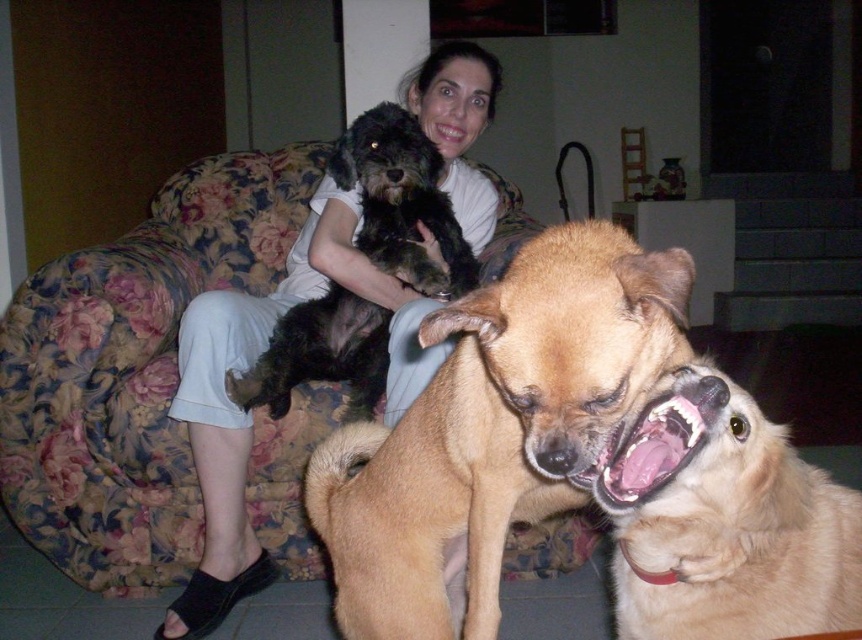
Is point (642, 536) closer to camera compared to point (391, 288)?

That is True.

Who is shorter, golden fur dog at lower right or white cotton shirt at upper center?

With less height is golden fur dog at lower right.

This screenshot has height=640, width=862. What do you see at coordinates (726, 522) in the screenshot? I see `golden fur dog at lower right` at bounding box center [726, 522].

This screenshot has width=862, height=640. Find the location of `golden fur dog at lower right`. golden fur dog at lower right is located at coordinates (726, 522).

Does light brown fur dog at center have a smaller size compared to shaggy black dog at upper center?

No, light brown fur dog at center is not smaller than shaggy black dog at upper center.

Which is behind, point (481, 317) or point (428, 275)?

The point (428, 275) is more distant.

I want to click on light brown fur dog at center, so click(495, 429).

Between light brown fur dog at center and white cotton shirt at upper center, which one appears on the right side from the viewer's perspective?

light brown fur dog at center

Between light brown fur dog at center and white cotton shirt at upper center, which one is positioned higher?

Positioned higher is white cotton shirt at upper center.

Identify the location of light brown fur dog at center. This screenshot has height=640, width=862. (495, 429).